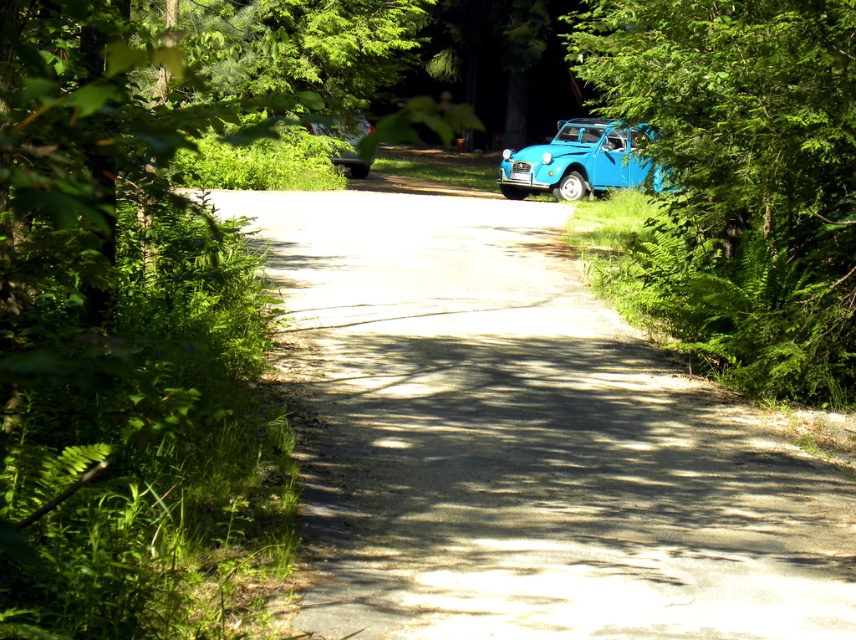
You are standing at the point labeled point (x=361, y=124) on the left side of the road in the forest scene. You want to walk to the point labeled point (x=467, y=353) on the right side of the road. Given the dense vegetation on the left side of the road, will you have to cross the road to reach your destination?

Yes, you will have to cross the road to reach point (x=467, y=353) because it is on the right side of the road, while you are starting from the left side. The dense vegetation on the left side may block a direct path, so crossing the road is necessary.

You are a hiker who has just finished a long trek and wants to take a photo of the blue matte car at right from the road. Since you want the car to be the main focus, where should you stand relative to the car to ensure it is centered in your photo? Use the coordinates provided in the description to determine the best position.

To center the blue matte car at right in your photo, you should stand directly opposite its position at point 0.252 on the x and 0.679 on the y. This means positioning yourself along the line perpendicular to the road at those coordinates, ensuring the car is framed centrally in your shot.

You are driving a metallic silver car at center and want to park it on the side of the road. Based on the scene, which direction should you move to park without hitting the blue matte car at right?

The blue matte car at right is to the right of the metallic silver car at center. To park without hitting it, you should move to the left side of the road where there is less vegetation and space available.